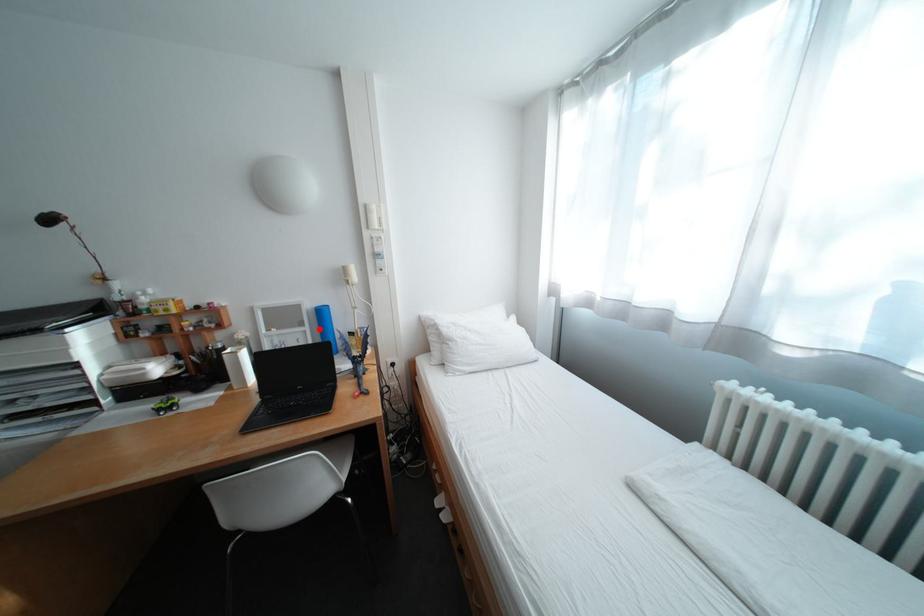
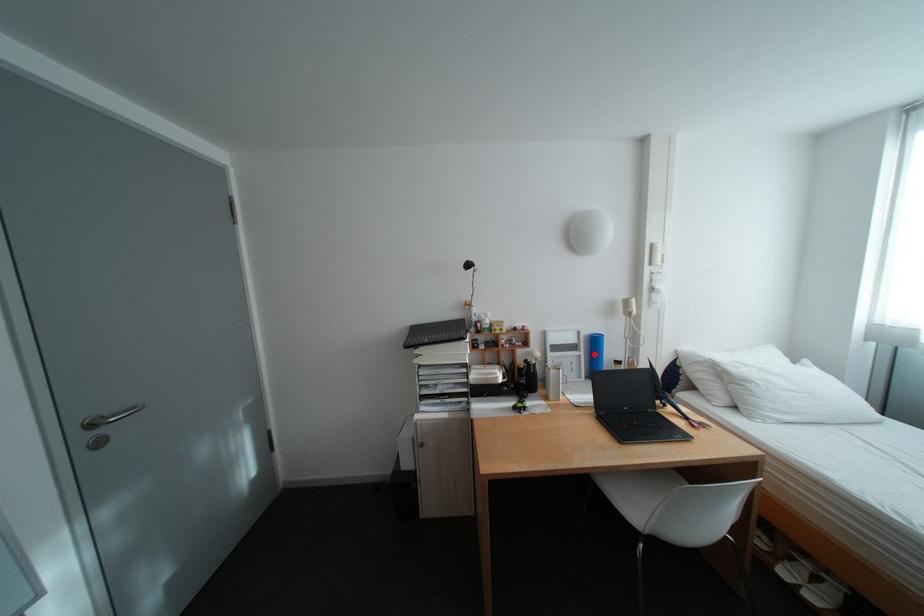
I am providing you with two images of the same scene from different viewpoints. A red point is marked on the first image and another point is marked on the second image. Is the marked point in image1 the same physical position as the marked point in image2?

Yes